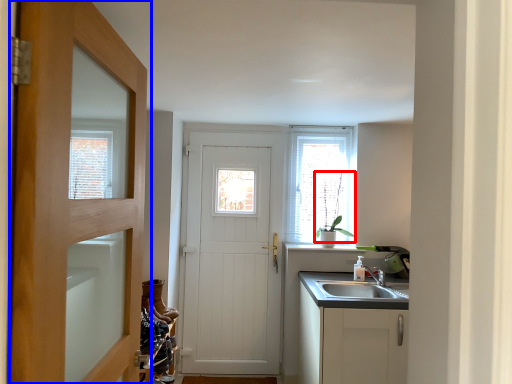
Question: Which of the following is the closest to the observer, plant (highlighted by a red box) or door (highlighted by a blue box)?

Choices:
 (A) plant
 (B) door

Answer: (B)